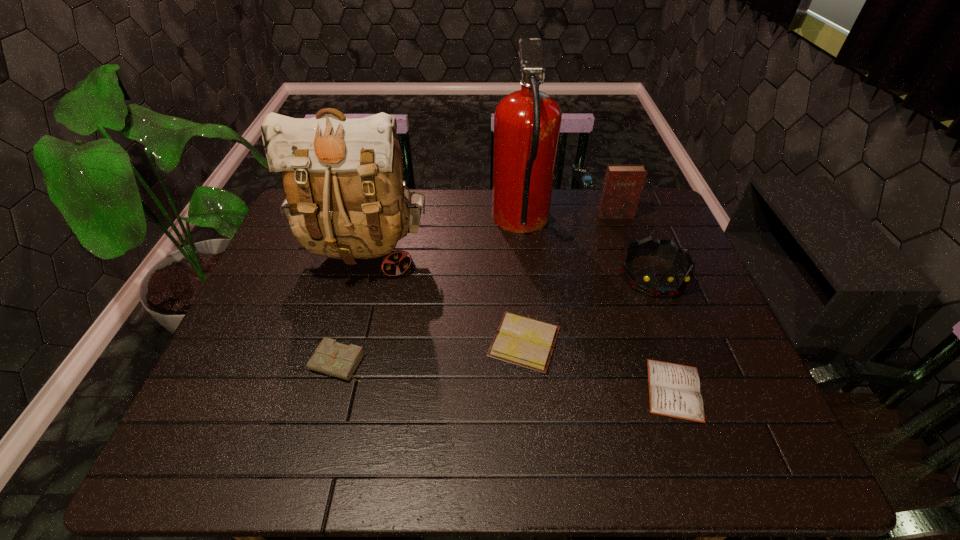
Identify the location of fire extinguisher. The width and height of the screenshot is (960, 540). (527, 122).

Image resolution: width=960 pixels, height=540 pixels. What are the coordinates of `backpack` in the screenshot? It's located at (342, 178).

In order to click on the tallest diary in this screenshot , I will do click(x=623, y=184).

You are a GUI agent. You are given a task and a screenshot of the screen. Output one action in this format:
    pyautogui.click(x=<x>, y=<y>)
    Task: Click on the farthest diary
    Image resolution: width=960 pixels, height=540 pixels.
    Given the screenshot: What is the action you would take?
    pyautogui.click(x=623, y=184)

At what (x,y) coordinates should I click in order to perform the action: click on tiara. Please return your answer as a coordinate pair (x, y). Looking at the image, I should click on (668, 286).

The image size is (960, 540). I want to click on the third shortest diary, so click(332, 358).

Image resolution: width=960 pixels, height=540 pixels. I want to click on the fifth tallest object, so click(x=332, y=358).

The image size is (960, 540). In order to click on the third diary from right to left in this screenshot , I will do `click(526, 342)`.

Locate an element on the screen. This screenshot has height=540, width=960. the third tallest diary is located at coordinates (526, 342).

Identify the location of the shortest diary. The height and width of the screenshot is (540, 960). 674,390.